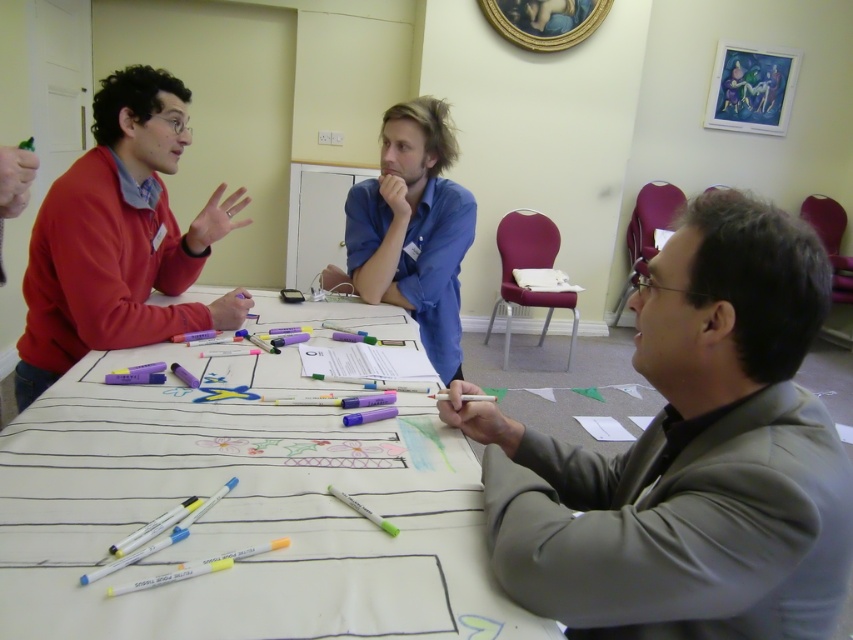
Where is `white paper at center`? white paper at center is located at coordinates (242, 509).

Who is more forward, (480, 516) or (492, 524)?

Point (492, 524) is in front.

The image size is (853, 640). Identify the location of white paper at center. point(242,509).

Is matte red sweater at left smaller than blue cotton shirt at center?

No.

From the picture: Between matte red sweater at left and blue cotton shirt at center, which one appears on the right side from the viewer's perspective?

blue cotton shirt at center is more to the right.

Identify the location of matte red sweater at left. The image size is (853, 640). (120, 237).

Can you confirm if gray suit jacket at lower right is positioned to the right of matte red sweater at left?

Correct, you'll find gray suit jacket at lower right to the right of matte red sweater at left.

Describe the element at coordinates (689, 456) in the screenshot. I see `gray suit jacket at lower right` at that location.

The height and width of the screenshot is (640, 853). Identify the location of gray suit jacket at lower right. (689, 456).